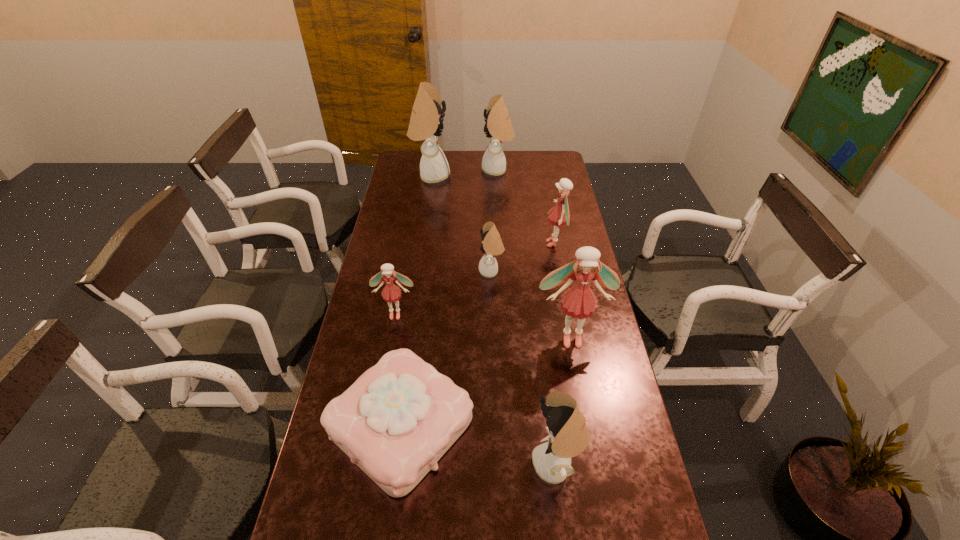
Identify the location of vacant space located on the front-facing side of the farthest pink doll. (527, 244).

I want to click on vacant space located 0.180m at the front face of the nearest doll, so click(463, 464).

Locate an element on the screen. The image size is (960, 540). vacant space located 0.300m at the front face of the nearest doll is located at coordinates (417, 464).

The height and width of the screenshot is (540, 960). I want to click on blank space located 0.280m at the front face of the nearest doll, so click(424, 464).

Locate an element on the screen. The width and height of the screenshot is (960, 540). blank space located 0.140m at the front face of the smallest black doll is located at coordinates click(442, 271).

Image resolution: width=960 pixels, height=540 pixels. Identify the location of free space located 0.330m at the front face of the smallest black doll. (392, 271).

Image resolution: width=960 pixels, height=540 pixels. Identify the location of vacant position located 0.340m at the front face of the smallest black doll. (389, 271).

Identify the location of free space located 0.140m on the front-facing side of the second farthest pink doll. (388, 355).

Find the location of `free spot located on the back of the pink cake`. free spot located on the back of the pink cake is located at coordinates (414, 330).

This screenshot has width=960, height=540. Find the location of `cake present at the left edge`. cake present at the left edge is located at coordinates (395, 422).